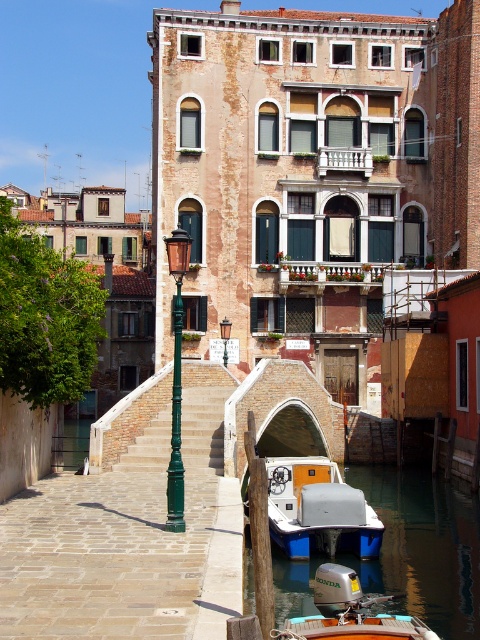
Does white plastic boat at lower center have a smaller size compared to green concrete stairs at center?

Incorrect, white plastic boat at lower center is not smaller in size than green concrete stairs at center.

The height and width of the screenshot is (640, 480). Identify the location of white plastic boat at lower center. (317, 509).

Between point (273, 632) and point (224, 320), which one is positioned in front?

Point (273, 632)

Between metallic silver motorboat at center and green painted metal streetlamp at center, which one appears on the left side from the viewer's perspective?

From the viewer's perspective, green painted metal streetlamp at center appears more on the left side.

Locate an element on the screen. metallic silver motorboat at center is located at coordinates (349, 612).

Does blue plastic boat at lower center lie in front of green painted metal streetlamp at center-left?

No, blue plastic boat at lower center is behind green painted metal streetlamp at center-left.

Who is positioned more to the left, blue plastic boat at lower center or green painted metal streetlamp at center-left?

green painted metal streetlamp at center-left

Between point (284, 593) and point (175, 388), which one is positioned behind?

The point (284, 593) is behind.

Locate an element on the screen. This screenshot has width=480, height=640. blue plastic boat at lower center is located at coordinates point(422,547).